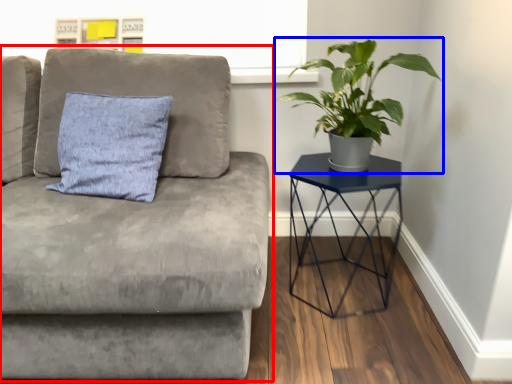
Question: Among these objects, which one is nearest to the camera, studio couch (highlighted by a red box) or houseplant (highlighted by a blue box)?

Choices:
 (A) studio couch
 (B) houseplant

Answer: (A)